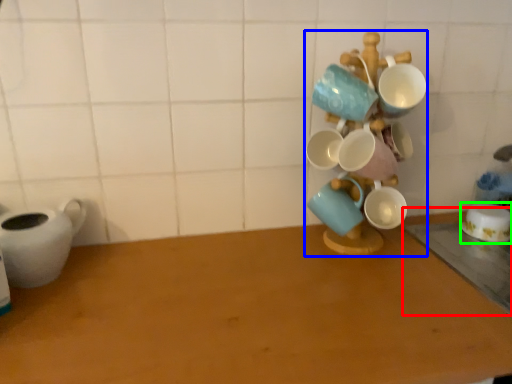
Question: Which is farther away from table (highlighted by a red box)? collection (highlighted by a blue box) or coffee cup (highlighted by a green box)?

Choices:
 (A) collection
 (B) coffee cup

Answer: (A)